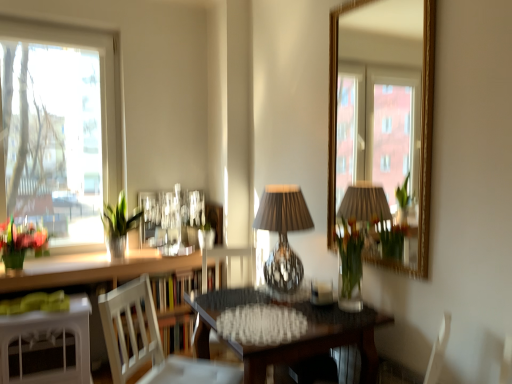
Question: Is green glass vase at left at the right side of translucent glass vase at center?

Choices:
 (A) no
 (B) yes

Answer: (A)

Question: Is green glass vase at left in front of translucent glass vase at center?

Choices:
 (A) no
 (B) yes

Answer: (A)

Question: Considering the relative sizes of green glass vase at left and translucent glass vase at center in the image provided, is green glass vase at left wider than translucent glass vase at center?

Choices:
 (A) no
 (B) yes

Answer: (B)

Question: Is green glass vase at left to the left of translucent glass vase at center from the viewer's perspective?

Choices:
 (A) yes
 (B) no

Answer: (A)

Question: Considering the relative sizes of green glass vase at left and translucent glass vase at center in the image provided, is green glass vase at left bigger than translucent glass vase at center?

Choices:
 (A) no
 (B) yes

Answer: (B)

Question: Considering their positions, is white wood chair at center, which is the second chair from back to front, located in front of or behind white wood chair at center, the 2th chair positioned from the front?

Choices:
 (A) front
 (B) behind

Answer: (A)

Question: From a real-world perspective, is white wood chair at center, the 1th chair positioned from the front, positioned above or below white wood chair at center, which appears as the 1th chair when viewed from the back?

Choices:
 (A) above
 (B) below

Answer: (A)

Question: From the image's perspective, is white wood chair at center, which is the second chair from back to front, located above or below white wood chair at center, the 2th chair positioned from the front?

Choices:
 (A) below
 (B) above

Answer: (B)

Question: Looking at the image, does white wood chair at center, which is the second chair from back to front, seem bigger or smaller compared to white wood chair at center, the 2th chair positioned from the front?

Choices:
 (A) big
 (B) small

Answer: (B)

Question: From the image's perspective, is white glossy counter top at lower left positioned above or below wooden textured table at center, which appears as the 2th table when viewed from the left?

Choices:
 (A) below
 (B) above

Answer: (B)

Question: Is white glossy counter top at lower left to the left or to the right of wooden textured table at center, placed as the 1th table when sorted from right to left, in the image?

Choices:
 (A) right
 (B) left

Answer: (B)

Question: From a real-world perspective, is white glossy counter top at lower left physically located above or below wooden textured table at center, placed as the 1th table when sorted from right to left?

Choices:
 (A) below
 (B) above

Answer: (B)

Question: In terms of size, does white glossy counter top at lower left appear bigger or smaller than wooden textured table at center, which appears as the 2th table when viewed from the left?

Choices:
 (A) big
 (B) small

Answer: (B)

Question: Does point (370, 309) appear closer or farther from the camera than point (195, 347)?

Choices:
 (A) closer
 (B) farther

Answer: (A)

Question: Do you think wooden textured table at center, which appears as the 2th table when viewed from the left, is within white wood chair at center, the 2th chair positioned from the front, or outside of it?

Choices:
 (A) outside
 (B) inside

Answer: (A)